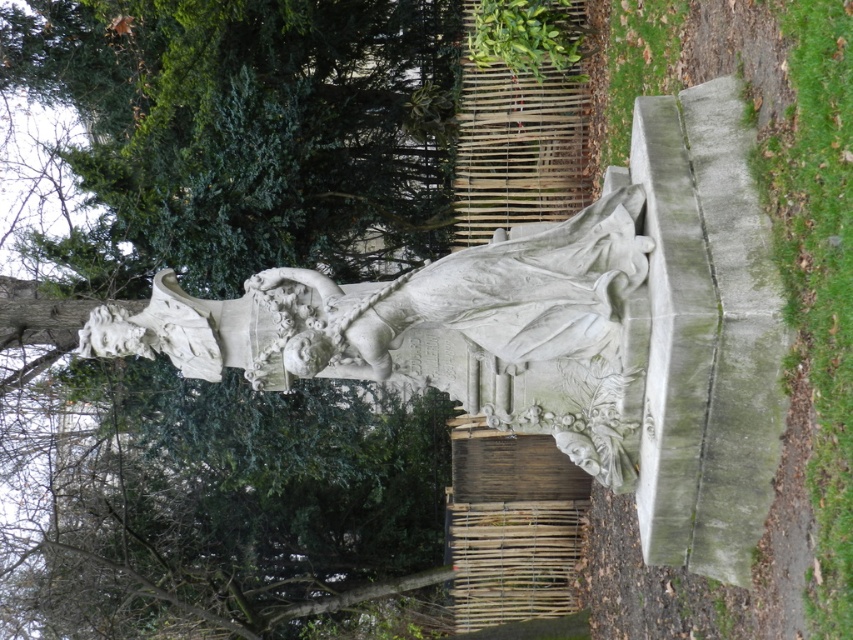
Does green leafy tree at upper left appear on the left side of white stone statue at center?

Correct, you'll find green leafy tree at upper left to the left of white stone statue at center.

Is green leafy tree at upper left thinner than white stone statue at center?

Yes, green leafy tree at upper left is thinner than white stone statue at center.

Is point (213, 99) more distant than point (444, 340)?

That is True.

Image resolution: width=853 pixels, height=640 pixels. Find the location of `green leafy tree at upper left`. green leafy tree at upper left is located at coordinates (244, 132).